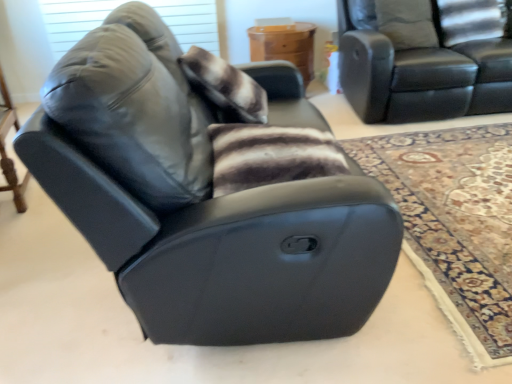
Question: Is wooden table at left, the first table when ordered from left to right, with matte gray window screen at upper left?

Choices:
 (A) yes
 (B) no

Answer: (B)

Question: Is wooden table at left, arranged as the first table when viewed from the front, wider than matte gray window screen at upper left?

Choices:
 (A) no
 (B) yes

Answer: (B)

Question: Is wooden table at left, the second table positioned from the back, further to camera compared to matte gray window screen at upper left?

Choices:
 (A) no
 (B) yes

Answer: (A)

Question: From the image's perspective, is wooden table at left, the first table when ordered from left to right, beneath matte gray window screen at upper left?

Choices:
 (A) yes
 (B) no

Answer: (A)

Question: From the image's perspective, is wooden table at left, the first table when ordered from left to right, above matte gray window screen at upper left?

Choices:
 (A) yes
 (B) no

Answer: (B)

Question: Considering the relative sizes of wooden table at left, the first table when ordered from left to right, and matte gray window screen at upper left in the image provided, is wooden table at left, the first table when ordered from left to right, thinner than matte gray window screen at upper left?

Choices:
 (A) yes
 (B) no

Answer: (B)

Question: From a real-world perspective, is black leather recliner at center under matte gray window screen at upper left?

Choices:
 (A) no
 (B) yes

Answer: (B)

Question: Does black leather recliner at center have a lesser width compared to matte gray window screen at upper left?

Choices:
 (A) yes
 (B) no

Answer: (B)

Question: Is black leather recliner at center smaller than matte gray window screen at upper left?

Choices:
 (A) no
 (B) yes

Answer: (A)

Question: From a real-world perspective, is black leather recliner at center located higher than matte gray window screen at upper left?

Choices:
 (A) no
 (B) yes

Answer: (A)

Question: Can you confirm if black leather recliner at center is wider than matte gray window screen at upper left?

Choices:
 (A) yes
 (B) no

Answer: (A)

Question: From the image's perspective, is black leather recliner at center located above matte gray window screen at upper left?

Choices:
 (A) no
 (B) yes

Answer: (A)

Question: Does wooden table at center, which appears as the second table when ordered from the bottom, have a greater height compared to black leather recliner at center?

Choices:
 (A) yes
 (B) no

Answer: (B)